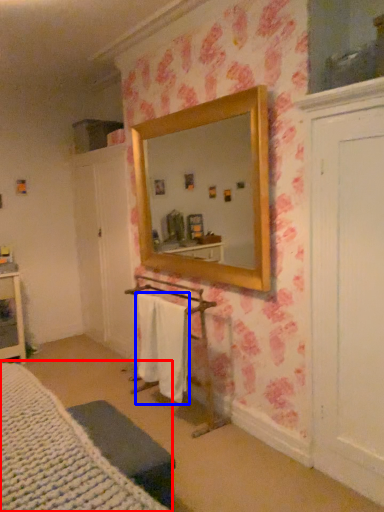
Question: Which object appears closest to the camera in this image, bed (highlighted by a red box) or bath towel (highlighted by a blue box)?

Choices:
 (A) bed
 (B) bath towel

Answer: (A)